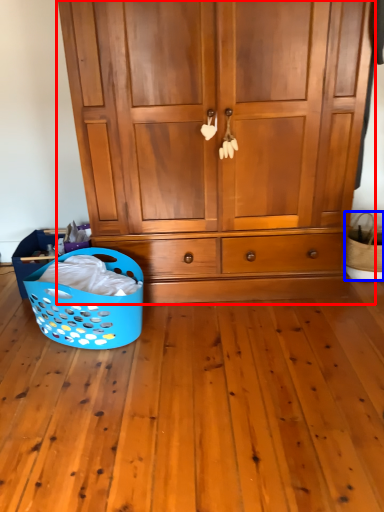
Question: Which point is closer to the camera, cupboard (highlighted by a red box) or basket (highlighted by a blue box)?

Choices:
 (A) cupboard
 (B) basket

Answer: (A)